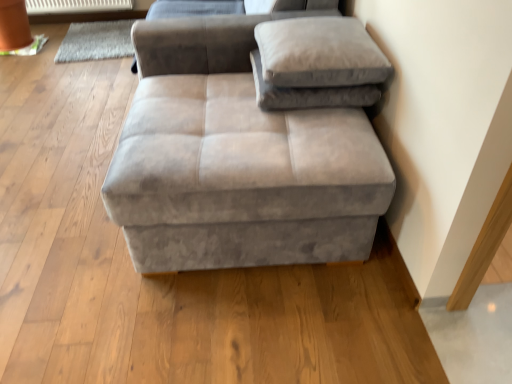
Where is `suede-like beige pillow at upper right, which appears as the 2th pillow when ordered from the bottom`? This screenshot has width=512, height=384. suede-like beige pillow at upper right, which appears as the 2th pillow when ordered from the bottom is located at coordinates (319, 53).

The height and width of the screenshot is (384, 512). What do you see at coordinates (237, 160) in the screenshot? I see `suede gray ottoman at center` at bounding box center [237, 160].

Describe the element at coordinates (96, 41) in the screenshot. I see `gray woolen mat at upper left` at that location.

How much space does suede gray pillow at upper right, which is the 2th pillow in top-to-bottom order, occupy vertically?

suede gray pillow at upper right, which is the 2th pillow in top-to-bottom order, is 3.64 inches in height.

What are the coordinates of `suede-like beige pillow at upper right, the first pillow when ordered from top to bottom` in the screenshot? It's located at (319, 53).

Where is `pillow that is the 1st one when counting rightward from the gray woolen mat at upper left`? The width and height of the screenshot is (512, 384). pillow that is the 1st one when counting rightward from the gray woolen mat at upper left is located at coordinates (319, 53).

How different are the orientations of gray woolen mat at upper left and suede-like beige pillow at upper right, which appears as the 2th pillow when ordered from the bottom, in degrees?

There is a 4.44-degree angle between the facing directions of gray woolen mat at upper left and suede-like beige pillow at upper right, which appears as the 2th pillow when ordered from the bottom.

From a real-world perspective, is gray woolen mat at upper left positioned under suede-like beige pillow at upper right, the first pillow when ordered from top to bottom, based on gravity?

Correct, in the physical world, gray woolen mat at upper left is lower than suede-like beige pillow at upper right, the first pillow when ordered from top to bottom.

Does point (88, 49) lie in front of point (274, 27)?

No, (88, 49) is further to viewer.

Between gray woolen mat at upper left and white plastic radiator at upper left, which one is positioned in front?

gray woolen mat at upper left is more forward.

Considering the sizes of objects gray woolen mat at upper left and white plastic radiator at upper left in the image provided, who is taller, gray woolen mat at upper left or white plastic radiator at upper left?

Standing taller between the two is white plastic radiator at upper left.

From a real-world perspective, is gray woolen mat at upper left above or below white plastic radiator at upper left?

In terms of real-world spatial position, gray woolen mat at upper left is below white plastic radiator at upper left.

Can you confirm if suede gray ottoman at center is thinner than gray woolen mat at upper left?

In fact, suede gray ottoman at center might be wider than gray woolen mat at upper left.

From a real-world perspective, is suede gray ottoman at center positioned under gray woolen mat at upper left based on gravity?

No, from a real-world perspective, suede gray ottoman at center is not beneath gray woolen mat at upper left.

Which object is more forward, suede gray ottoman at center or gray woolen mat at upper left?

Positioned in front is suede gray ottoman at center.

Are suede gray ottoman at center and gray woolen mat at upper left making contact?

No, suede gray ottoman at center is not next to gray woolen mat at upper left.

Looking at their sizes, would you say suede gray pillow at upper right, placed as the first pillow when sorted from bottom to top, is wider or thinner than white plastic radiator at upper left?

Considering their sizes, suede gray pillow at upper right, placed as the first pillow when sorted from bottom to top, looks broader than white plastic radiator at upper left.

The height and width of the screenshot is (384, 512). Identify the location of radiator that is on the left side of suede gray pillow at upper right, placed as the first pillow when sorted from bottom to top. (76, 6).

Can you confirm if suede gray pillow at upper right, which is the 2th pillow in top-to-bottom order, is smaller than white plastic radiator at upper left?

Correct, suede gray pillow at upper right, which is the 2th pillow in top-to-bottom order, occupies less space than white plastic radiator at upper left.

Measure the distance from suede gray pillow at upper right, which is the 2th pillow in top-to-bottom order, to white plastic radiator at upper left.

2.66 meters.

Is suede-like beige pillow at upper right, which appears as the 2th pillow when ordered from the bottom, turned away from suede gray ottoman at center?

No.

Which is behind, suede-like beige pillow at upper right, the first pillow when ordered from top to bottom, or suede gray ottoman at center?

suede-like beige pillow at upper right, the first pillow when ordered from top to bottom.

Which is closer, (x=337, y=74) or (x=175, y=190)?

Point (x=337, y=74).

Who is shorter, suede-like beige pillow at upper right, the first pillow when ordered from top to bottom, or suede gray ottoman at center?

suede-like beige pillow at upper right, the first pillow when ordered from top to bottom, is shorter.

Between suede gray pillow at upper right, which is the 2th pillow in top-to-bottom order, and suede-like beige pillow at upper right, which appears as the 2th pillow when ordered from the bottom, which one has larger width?

suede-like beige pillow at upper right, which appears as the 2th pillow when ordered from the bottom, is wider.

From a real-world perspective, does suede gray pillow at upper right, which is the 2th pillow in top-to-bottom order, sit lower than suede-like beige pillow at upper right, which appears as the 2th pillow when ordered from the bottom?

Yes, from a real-world perspective, suede gray pillow at upper right, which is the 2th pillow in top-to-bottom order, is below suede-like beige pillow at upper right, which appears as the 2th pillow when ordered from the bottom.

Is suede-like beige pillow at upper right, which appears as the 2th pillow when ordered from the bottom, inside suede gray pillow at upper right, which is the 2th pillow in top-to-bottom order?

Actually, suede-like beige pillow at upper right, which appears as the 2th pillow when ordered from the bottom, is outside suede gray pillow at upper right, which is the 2th pillow in top-to-bottom order.

Who is more distant, suede gray pillow at upper right, which is the 2th pillow in top-to-bottom order, or suede-like beige pillow at upper right, which appears as the 2th pillow when ordered from the bottom?

suede gray pillow at upper right, which is the 2th pillow in top-to-bottom order.

Is suede-like beige pillow at upper right, which appears as the 2th pillow when ordered from the bottom, positioned behind gray woolen mat at upper left?

No.

Based on the photo, from a real-world perspective, who is located lower, suede-like beige pillow at upper right, which appears as the 2th pillow when ordered from the bottom, or gray woolen mat at upper left?

From a 3D spatial view, gray woolen mat at upper left is below.

Is suede-like beige pillow at upper right, which appears as the 2th pillow when ordered from the bottom, not inside gray woolen mat at upper left?

Indeed, suede-like beige pillow at upper right, which appears as the 2th pillow when ordered from the bottom, is completely outside gray woolen mat at upper left.

What are the coordinates of `mat located on the left of suede-like beige pillow at upper right, the first pillow when ordered from top to bottom` in the screenshot? It's located at (96, 41).

You are a GUI agent. You are given a task and a screenshot of the screen. Output one action in this format:
    pyautogui.click(x=<x>, y=<y>)
    Task: Click on the radiator behind the gray woolen mat at upper left
    
    Given the screenshot: What is the action you would take?
    pyautogui.click(x=76, y=6)

Consider the image. Looking at the image, which one is located closer to suede gray ottoman at center, suede-like beige pillow at upper right, the first pillow when ordered from top to bottom, or suede gray pillow at upper right, which is the 2th pillow in top-to-bottom order?

The object closer to suede gray ottoman at center is suede gray pillow at upper right, which is the 2th pillow in top-to-bottom order.

When comparing their distances from suede-like beige pillow at upper right, which appears as the 2th pillow when ordered from the bottom, does suede gray ottoman at center or white plastic radiator at upper left seem further?

white plastic radiator at upper left.

Estimate the real-world distances between objects in this image. Which object is closer to suede gray ottoman at center, white plastic radiator at upper left or suede gray pillow at upper right, placed as the first pillow when sorted from bottom to top?

suede gray pillow at upper right, placed as the first pillow when sorted from bottom to top, is positioned closer to the anchor suede gray ottoman at center.

When comparing their distances from gray woolen mat at upper left, does suede gray ottoman at center or suede gray pillow at upper right, which is the 2th pillow in top-to-bottom order, seem closer?

Based on the image, suede gray ottoman at center appears to be nearer to gray woolen mat at upper left.

When comparing their distances from suede gray pillow at upper right, which is the 2th pillow in top-to-bottom order, does gray woolen mat at upper left or suede-like beige pillow at upper right, which appears as the 2th pillow when ordered from the bottom, seem closer?

The object closer to suede gray pillow at upper right, which is the 2th pillow in top-to-bottom order, is suede-like beige pillow at upper right, which appears as the 2th pillow when ordered from the bottom.

Which object lies further to the anchor point suede-like beige pillow at upper right, which appears as the 2th pillow when ordered from the bottom, white plastic radiator at upper left or suede gray pillow at upper right, which is the 2th pillow in top-to-bottom order?

white plastic radiator at upper left.

Which object lies further to the anchor point suede gray ottoman at center, gray woolen mat at upper left or white plastic radiator at upper left?

white plastic radiator at upper left lies further to suede gray ottoman at center than the other object.

In the scene shown: Based on their spatial positions, is suede gray ottoman at center or gray woolen mat at upper left further from suede-like beige pillow at upper right, the first pillow when ordered from top to bottom?

gray woolen mat at upper left is positioned further to the anchor suede-like beige pillow at upper right, the first pillow when ordered from top to bottom.

The height and width of the screenshot is (384, 512). In order to click on mat located between suede gray ottoman at center and white plastic radiator at upper left in the depth direction in this screenshot , I will do `click(96, 41)`.

The width and height of the screenshot is (512, 384). I want to click on pillow between suede-like beige pillow at upper right, the first pillow when ordered from top to bottom, and suede gray ottoman at center from top to bottom, so click(309, 93).

Where is `pillow positioned between suede-like beige pillow at upper right, which appears as the 2th pillow when ordered from the bottom, and gray woolen mat at upper left from near to far`? The image size is (512, 384). pillow positioned between suede-like beige pillow at upper right, which appears as the 2th pillow when ordered from the bottom, and gray woolen mat at upper left from near to far is located at coordinates (309, 93).

Identify the location of pillow between suede-like beige pillow at upper right, which appears as the 2th pillow when ordered from the bottom, and white plastic radiator at upper left from front to back. (309, 93).